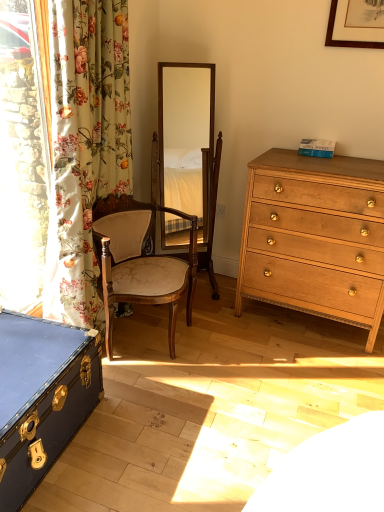
The image size is (384, 512). I want to click on vacant space in front of wooden swivel chair at center, so click(x=212, y=314).